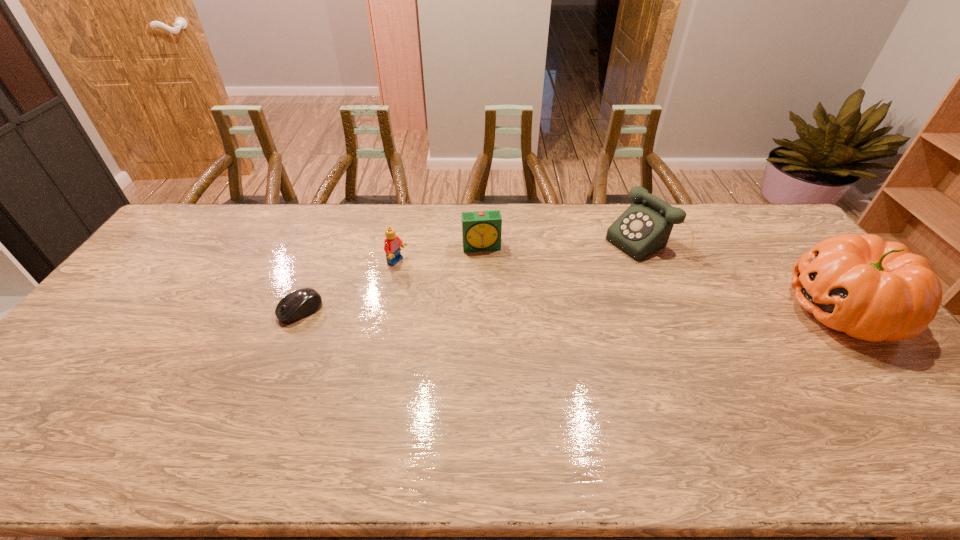
Where is `unoccupied area between the Lego and the third object from left to right`? unoccupied area between the Lego and the third object from left to right is located at coordinates (440, 254).

Find the location of a particular element. free spot between the second object from left to right and the mouse is located at coordinates (349, 286).

Identify the location of free space that is in between the leftmost object and the Lego. (349, 286).

Where is `vacant point located between the telephone and the third object from right to left`? The height and width of the screenshot is (540, 960). vacant point located between the telephone and the third object from right to left is located at coordinates (565, 245).

Where is `vacant region between the fourth object from right to left and the leftmost object`? Image resolution: width=960 pixels, height=540 pixels. vacant region between the fourth object from right to left and the leftmost object is located at coordinates (349, 286).

You are a GUI agent. You are given a task and a screenshot of the screen. Output one action in this format:
    pyautogui.click(x=<x>, y=<y>)
    Task: Click on the free point between the fourth object from left to right and the rightmost object
    
    Given the screenshot: What is the action you would take?
    pyautogui.click(x=747, y=276)

Find the location of a particular element. empty space between the second tallest object and the Lego is located at coordinates (523, 253).

Locate an element on the screen. unoccupied position between the leftmost object and the alarm clock is located at coordinates (391, 279).

Find the location of a particular element. Image resolution: width=960 pixels, height=540 pixels. free spot between the leftmost object and the alarm clock is located at coordinates (391, 279).

Identify the location of the fourth closest object to the alarm clock. (872, 290).